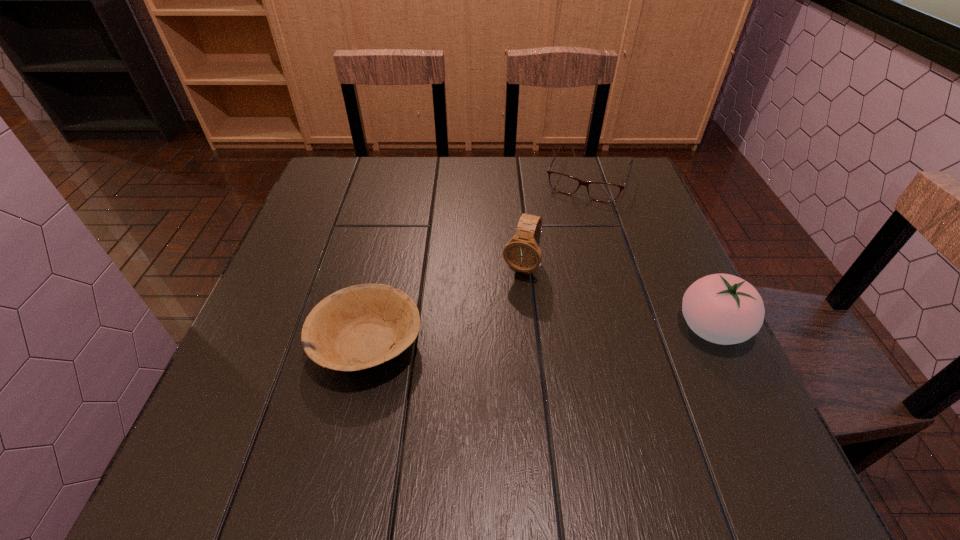
You are a GUI agent. You are given a task and a screenshot of the screen. Output one action in this format:
    pyautogui.click(x=<x>, y=<y>)
    Task: Click on the vacant position in the image that satisfies the following two spatial constraints: 1. on the back side of the tomato; 2. on the right side of the leftmost object
    The image size is (960, 540).
    Given the screenshot: What is the action you would take?
    pyautogui.click(x=371, y=328)

Identify the location of blank area in the image that satisfies the following two spatial constraints: 1. on the back side of the leftmost object; 2. on the left side of the tomato. The image size is (960, 540). click(371, 328).

Find the location of a particular element. vacant area that satisfies the following two spatial constraints: 1. on the back side of the leftmost object; 2. on the left side of the farthest object is located at coordinates coord(404,179).